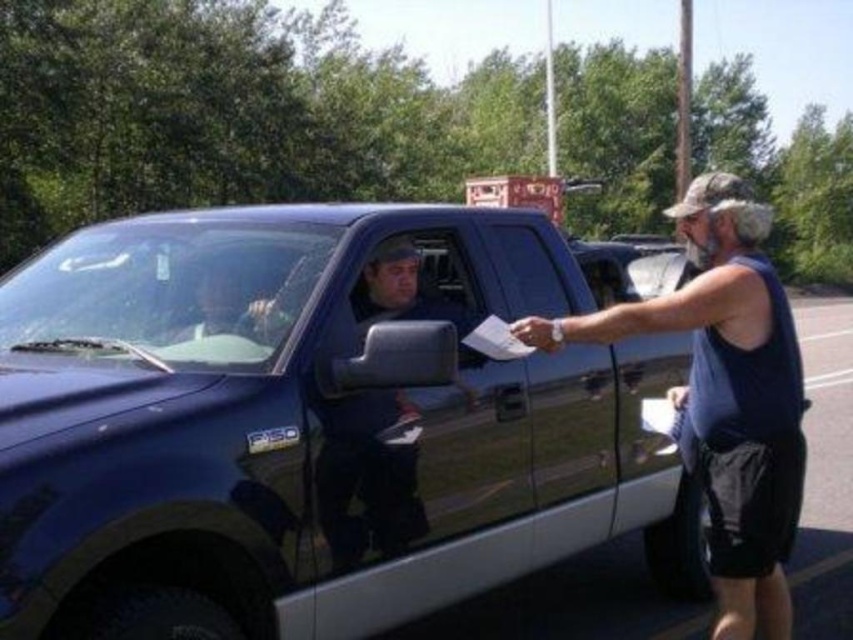
Question: Among these objects, which one is nearest to the camera?

Choices:
 (A) glossy blue truck at right
 (B) glossy blue truck at center

Answer: (B)

Question: Is glossy blue truck at center to the right of glossy blue truck at right from the viewer's perspective?

Choices:
 (A) no
 (B) yes

Answer: (A)

Question: Does glossy blue truck at center appear under glossy blue truck at right?

Choices:
 (A) no
 (B) yes

Answer: (A)

Question: Is glossy blue truck at center positioned in front of glossy blue truck at right?

Choices:
 (A) no
 (B) yes

Answer: (B)